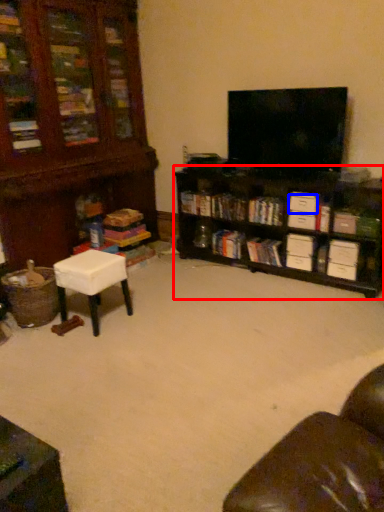
Question: Among these objects, which one is nearest to the camera, shelf (highlighted by a red box) or drawer (highlighted by a blue box)?

Choices:
 (A) shelf
 (B) drawer

Answer: (A)